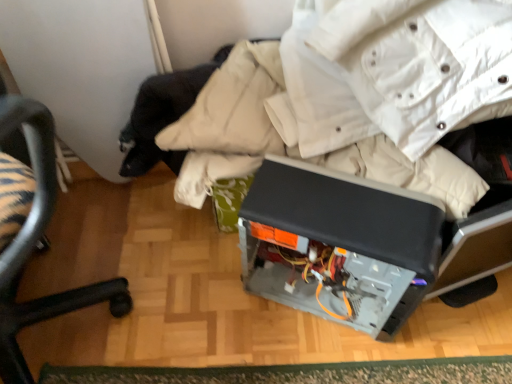
Question: Is satin black computer case at center at the right side of black plastic chair at lower left?

Choices:
 (A) no
 (B) yes

Answer: (B)

Question: Considering the relative positions of satin black computer case at center and black plastic chair at lower left in the image provided, is satin black computer case at center to the left of black plastic chair at lower left from the viewer's perspective?

Choices:
 (A) no
 (B) yes

Answer: (A)

Question: Can you see satin black computer case at center touching black plastic chair at lower left?

Choices:
 (A) no
 (B) yes

Answer: (A)

Question: Is satin black computer case at center further to camera compared to black plastic chair at lower left?

Choices:
 (A) yes
 (B) no

Answer: (A)

Question: From a real-world perspective, is satin black computer case at center below black plastic chair at lower left?

Choices:
 (A) yes
 (B) no

Answer: (A)

Question: Would you say satin black computer case at center is a long distance from black plastic chair at lower left?

Choices:
 (A) no
 (B) yes

Answer: (A)

Question: From a real-world perspective, is satin black computer case at center below green textured mat at lower center?

Choices:
 (A) yes
 (B) no

Answer: (B)

Question: Is satin black computer case at center shorter than green textured mat at lower center?

Choices:
 (A) yes
 (B) no

Answer: (B)

Question: Is green textured mat at lower center surrounded by satin black computer case at center?

Choices:
 (A) no
 (B) yes

Answer: (A)

Question: Is satin black computer case at center behind green textured mat at lower center?

Choices:
 (A) yes
 (B) no

Answer: (B)

Question: Does satin black computer case at center have a smaller size compared to green textured mat at lower center?

Choices:
 (A) no
 (B) yes

Answer: (A)

Question: Is satin black computer case at center wider than green textured mat at lower center?

Choices:
 (A) yes
 (B) no

Answer: (A)

Question: From the image's perspective, is green textured mat at lower center on top of black plastic chair at lower left?

Choices:
 (A) no
 (B) yes

Answer: (A)